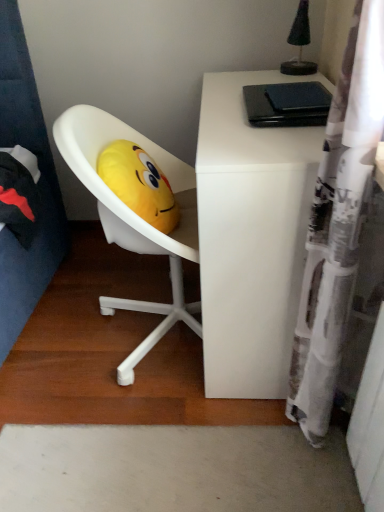
Question: Is the position of white printed fabric shower curtain at right more distant than that of white matte desk at upper right?

Choices:
 (A) no
 (B) yes

Answer: (A)

Question: From a real-world perspective, is white printed fabric shower curtain at right positioned over white matte desk at upper right based on gravity?

Choices:
 (A) yes
 (B) no

Answer: (A)

Question: Could white matte desk at upper right be considered to be inside white printed fabric shower curtain at right?

Choices:
 (A) no
 (B) yes

Answer: (A)

Question: Considering the relative positions of white printed fabric shower curtain at right and white matte desk at upper right in the image provided, is white printed fabric shower curtain at right to the left of white matte desk at upper right from the viewer's perspective?

Choices:
 (A) no
 (B) yes

Answer: (A)

Question: Can you confirm if white printed fabric shower curtain at right is wider than white matte desk at upper right?

Choices:
 (A) no
 (B) yes

Answer: (A)

Question: Considering the positions of white printed fabric shower curtain at right and white matte desk at upper right in the image, is white printed fabric shower curtain at right taller or shorter than white matte desk at upper right?

Choices:
 (A) short
 (B) tall

Answer: (B)

Question: Looking at their shapes, would you say white printed fabric shower curtain at right is wider or thinner than white matte desk at upper right?

Choices:
 (A) wide
 (B) thin

Answer: (B)

Question: From the image's perspective, is white printed fabric shower curtain at right positioned above or below white matte desk at upper right?

Choices:
 (A) above
 (B) below

Answer: (B)

Question: Is white printed fabric shower curtain at right to the left or to the right of white matte desk at upper right in the image?

Choices:
 (A) left
 (B) right

Answer: (B)

Question: Looking at their shapes, would you say white matte desk at upper right is wider or thinner than white printed fabric shower curtain at right?

Choices:
 (A) thin
 (B) wide

Answer: (B)

Question: Looking at the image, does white matte desk at upper right seem bigger or smaller compared to white printed fabric shower curtain at right?

Choices:
 (A) small
 (B) big

Answer: (B)

Question: From the image's perspective, relative to white printed fabric shower curtain at right, is white matte desk at upper right above or below?

Choices:
 (A) above
 (B) below

Answer: (A)

Question: Does point (266, 280) appear closer or farther from the camera than point (337, 317)?

Choices:
 (A) closer
 (B) farther

Answer: (B)

Question: In the image, is white printed fabric shower curtain at right positioned in front of or behind yellow plush at center?

Choices:
 (A) behind
 (B) front

Answer: (B)

Question: In terms of size, does white printed fabric shower curtain at right appear bigger or smaller than yellow plush at center?

Choices:
 (A) big
 (B) small

Answer: (A)